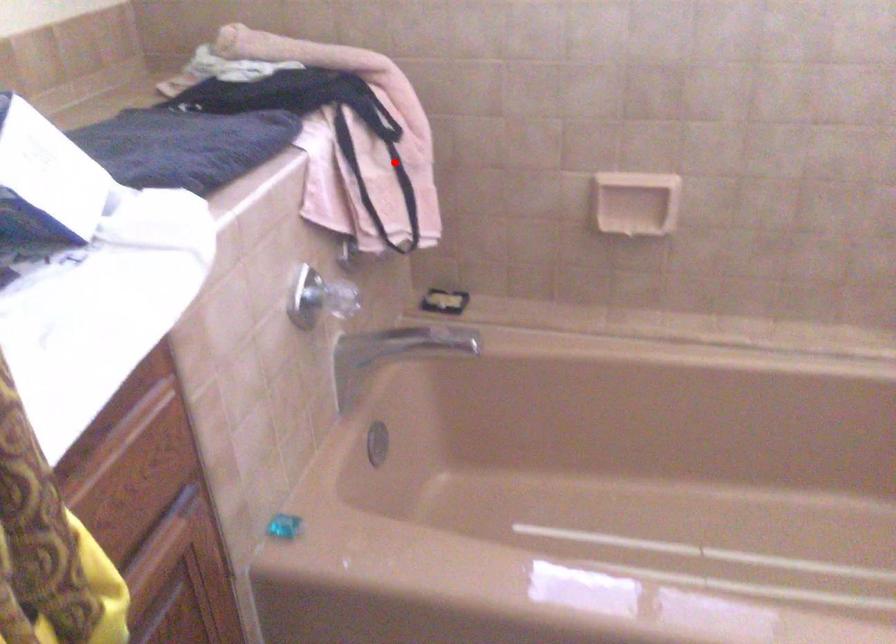
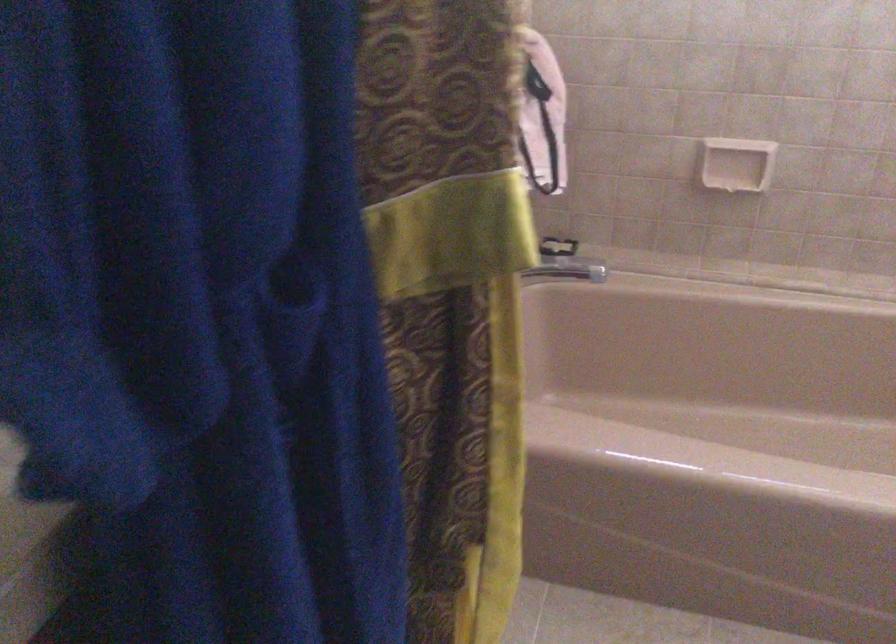
Question: A red point is marked in image1. In image2, is the corresponding 3D point closer to the camera or farther? Reply with the corresponding letter.

Choices:
 (A) The corresponding 3D point is closer.
 (B) The corresponding 3D point is farther.

Answer: (B)